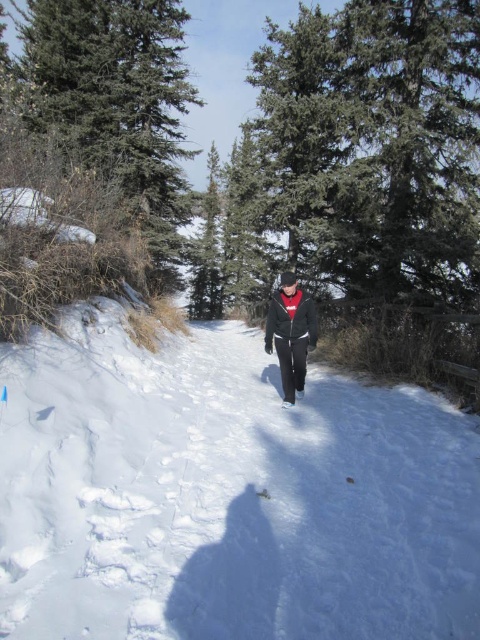
Question: Can you confirm if white fluffy snow at center is positioned below black matte jacket at center?

Choices:
 (A) yes
 (B) no

Answer: (A)

Question: Is the position of green matte tree at upper left more distant than that of black matte jacket at center?

Choices:
 (A) no
 (B) yes

Answer: (B)

Question: Does white fluffy snow at center have a larger size compared to green matte tree at upper left?

Choices:
 (A) no
 (B) yes

Answer: (A)

Question: Which object is farther from the camera taking this photo?

Choices:
 (A) green matte tree at upper left
 (B) white fluffy snow at center
 (C) black matte jacket at center

Answer: (A)

Question: Which point is closer to the camera?

Choices:
 (A) white fluffy snow at center
 (B) black matte jacket at center
 (C) green matte tree at upper left

Answer: (B)

Question: Which object is farther from the camera taking this photo?

Choices:
 (A) green matte tree at upper left
 (B) white fluffy snow at center
 (C) black matte jacket at center

Answer: (A)